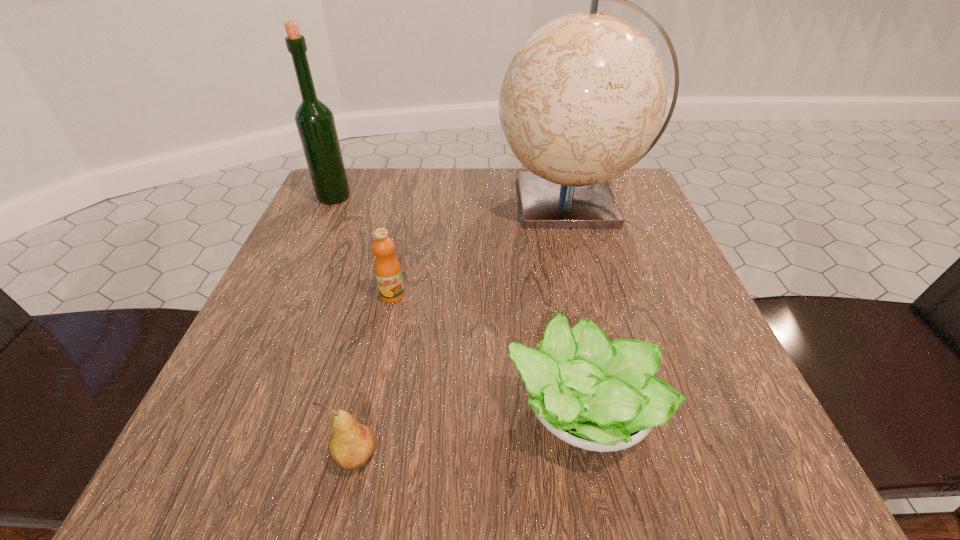
I want to click on object at the far right corner, so click(584, 96).

Where is `object that is at the near right corner`? object that is at the near right corner is located at coordinates (600, 396).

You are a GUI agent. You are given a task and a screenshot of the screen. Output one action in this format:
    pyautogui.click(x=<x>, y=<y>)
    Task: Click on the vacant space at the far edge
    
    Given the screenshot: What is the action you would take?
    pyautogui.click(x=425, y=173)

The image size is (960, 540). Find the location of `free space at the near edge of the desktop`. free space at the near edge of the desktop is located at coordinates (437, 474).

In the image, there is a desktop. What are the coordinates of `vacant area at the left edge` in the screenshot? It's located at (321, 227).

Where is `free space at the right edge`? The image size is (960, 540). free space at the right edge is located at coordinates (630, 295).

Find the location of a particular element. The width and height of the screenshot is (960, 540). vacant space at the far left corner is located at coordinates (347, 206).

Identify the location of free space at the near left corner of the desktop. (248, 475).

In order to click on free space between the orange juice and the leftmost object in this screenshot , I will do `click(363, 246)`.

Where is `free spot between the pear and the lettuce`? The height and width of the screenshot is (540, 960). free spot between the pear and the lettuce is located at coordinates (468, 433).